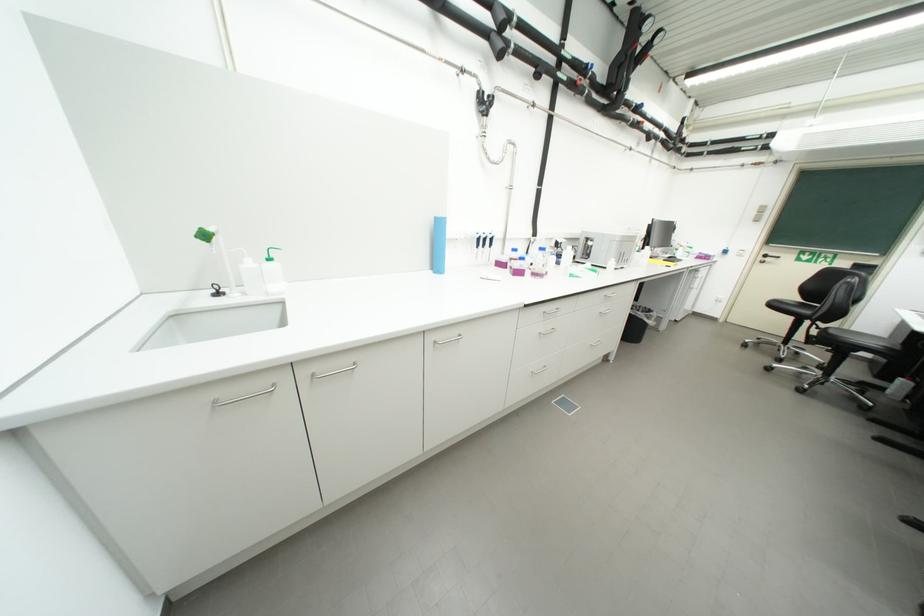
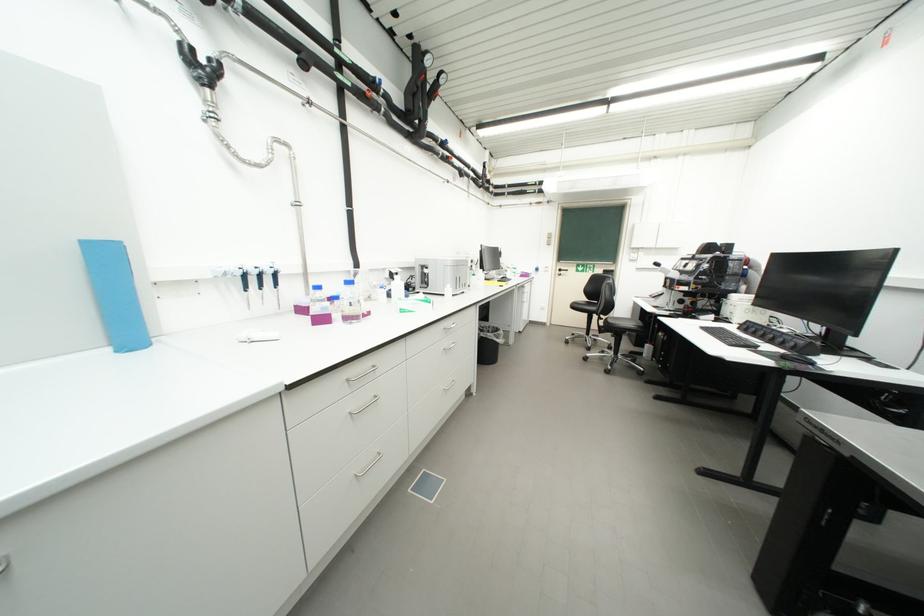
The point at (x=527, y=274) is marked in the first image. Where is the corresponding point in the second image?

(330, 321)